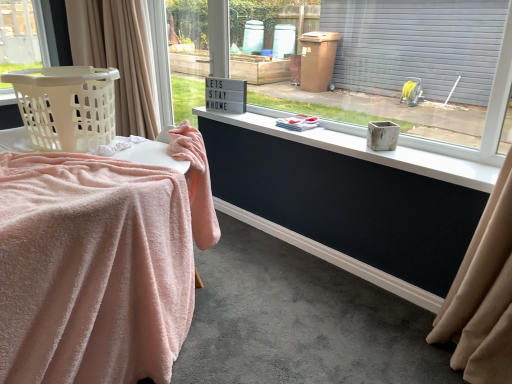
Question: From a real-world perspective, is beige plastic laundry basket at left on top of white plastic sign at upper center?

Choices:
 (A) yes
 (B) no

Answer: (B)

Question: Considering the relative sizes of beige plastic laundry basket at left and white plastic sign at upper center in the image provided, is beige plastic laundry basket at left smaller than white plastic sign at upper center?

Choices:
 (A) yes
 (B) no

Answer: (B)

Question: Is beige plastic laundry basket at left facing towards white plastic sign at upper center?

Choices:
 (A) yes
 (B) no

Answer: (B)

Question: Can you confirm if beige plastic laundry basket at left is shorter than white plastic sign at upper center?

Choices:
 (A) yes
 (B) no

Answer: (A)

Question: Is beige plastic laundry basket at left positioned in front of white plastic sign at upper center?

Choices:
 (A) yes
 (B) no

Answer: (A)

Question: Is beige plastic laundry basket at left thinner than white plastic sign at upper center?

Choices:
 (A) yes
 (B) no

Answer: (B)

Question: From a real-world perspective, is beige plastic laundry basket at left over white matte concrete at center?

Choices:
 (A) no
 (B) yes

Answer: (B)

Question: Is beige plastic laundry basket at left behind white matte concrete at center?

Choices:
 (A) no
 (B) yes

Answer: (A)

Question: Is white matte concrete at center surrounded by beige plastic laundry basket at left?

Choices:
 (A) yes
 (B) no

Answer: (B)

Question: From the image's perspective, is beige plastic laundry basket at left located above white matte concrete at center?

Choices:
 (A) yes
 (B) no

Answer: (A)

Question: Can you confirm if beige plastic laundry basket at left is bigger than white matte concrete at center?

Choices:
 (A) yes
 (B) no

Answer: (A)

Question: Is beige plastic laundry basket at left to the right of white matte concrete at center from the viewer's perspective?

Choices:
 (A) yes
 (B) no

Answer: (B)

Question: Is beige fabric curtain at left positioned beyond the bounds of matte concrete planter at center?

Choices:
 (A) yes
 (B) no

Answer: (A)